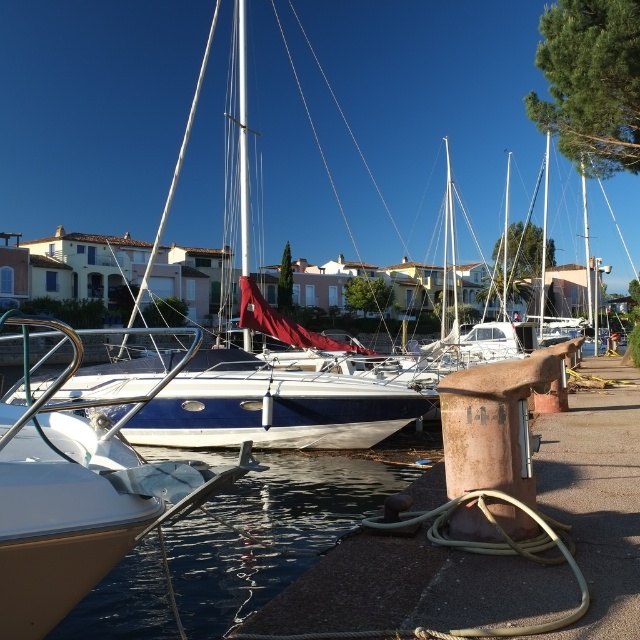
Consider the image. Which is more to the left, clear water at lower left or white glossy sailboat at center?

Positioned to the left is white glossy sailboat at center.

Between clear water at lower left and white glossy sailboat at center, which one has more height?

white glossy sailboat at center

Image resolution: width=640 pixels, height=640 pixels. I want to click on clear water at lower left, so click(x=269, y=531).

The image size is (640, 640). I want to click on clear water at lower left, so click(x=269, y=531).